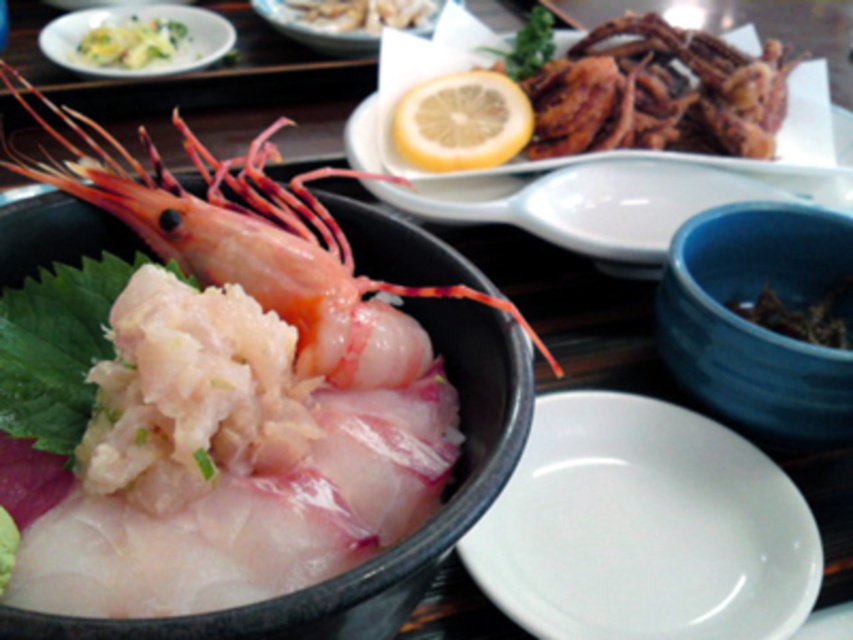
You are a food critic observing the seafood platter. You want to describe the spatial arrangement of the grilled squid at upper right and the yellow matte lemon at center. Which object is closer to you?

The grilled squid at upper right is closer to you than the yellow matte lemon at center.

From the picture: You are a food photographer setting up a shot of the seafood platter. You need to position a small garnish on the edge of the white glossy plate at center so it won not overlap with the brown dried seaweed at upper right. Given their sizes, will the plate have enough space for the garnish without moving the seaweed?

The white glossy plate at center has a larger width than the brown dried seaweed at upper right, so there should be sufficient space on the plate to place the garnish without overlapping the seaweed.

You are a food critic analyzing the layout of a Japanese seafood platter. The platter has a black bowl with sashimi and a shrimp on top. Where is the grilled squid at upper right located in relation to the black bowl?

The grilled squid at upper right is located at point (657, 93) relative to the image.